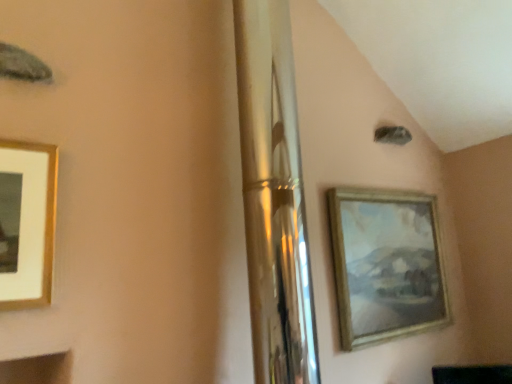
What do you see at coordinates (386, 264) in the screenshot? I see `wooden framed painting at upper right` at bounding box center [386, 264].

What is the approximate width of wooden framed painting at upper right?

The width of wooden framed painting at upper right is 3.43 inches.

The width and height of the screenshot is (512, 384). Identify the location of wooden framed painting at upper right. (386, 264).

I want to click on wooden framed painting at upper right, so click(386, 264).